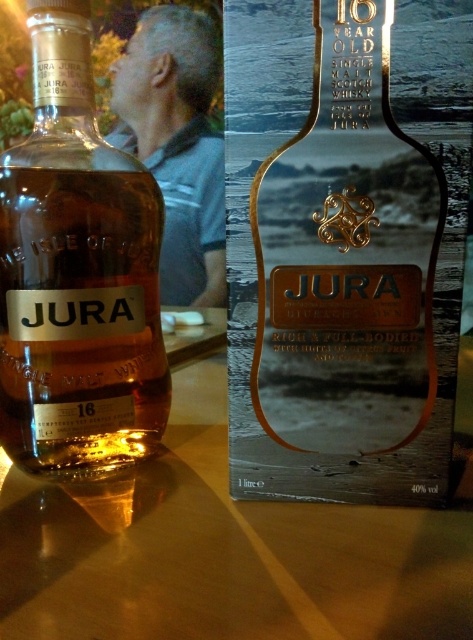
Which is above, gold metallic bottle at center or matte glass bottle at center?

Positioned higher is matte glass bottle at center.

Who is more forward, [457,161] or [5,284]?

Point [457,161] is in front.

The width and height of the screenshot is (473, 640). In order to click on gold metallic bottle at center in this screenshot , I will do `click(340, 257)`.